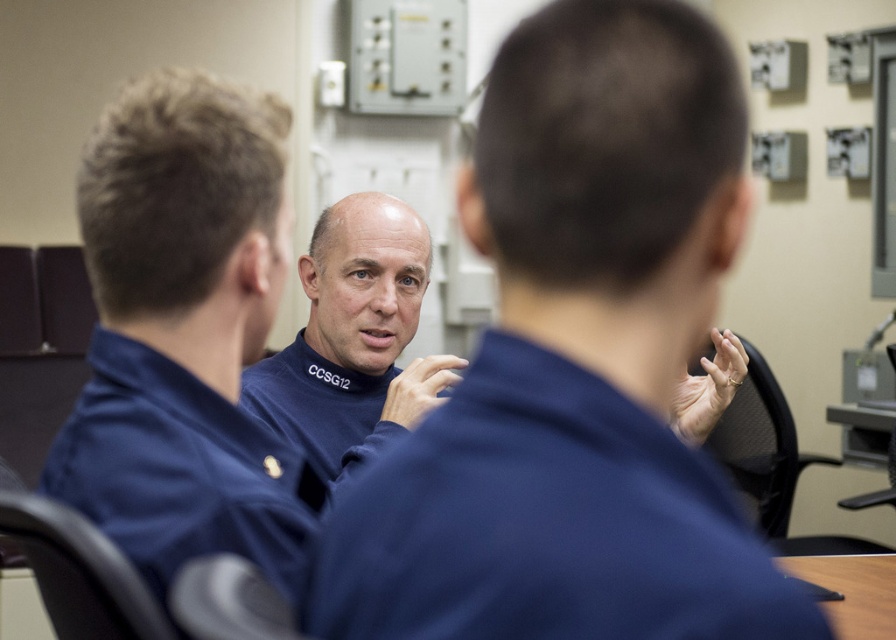
Question: Which point is farther to the camera?

Choices:
 (A) (127, 609)
 (B) (595, 416)

Answer: (A)

Question: Is black leather chair at lower left further to the viewer compared to gray fabric chair at lower left?

Choices:
 (A) yes
 (B) no

Answer: (A)

Question: Can you confirm if blue fabric shirt at center is bigger than gray fabric chair at lower left?

Choices:
 (A) no
 (B) yes

Answer: (B)

Question: Which point is farther to the camera?

Choices:
 (A) (71, 552)
 (B) (519, 563)
 (C) (513, 385)
 (D) (195, 540)

Answer: (D)

Question: Can you confirm if black leather chair at lower left is smaller than black mesh chair at right?

Choices:
 (A) no
 (B) yes

Answer: (B)

Question: Which object is farther from the camera taking this photo?

Choices:
 (A) gray fabric chair at lower left
 (B) navy blue uniform at center
 (C) blue fabric shirt at center

Answer: (C)